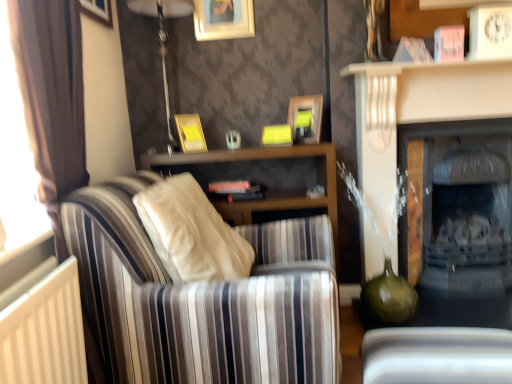
Question: Can you confirm if striped fabric couch at left is taller than matte black fireplace at right, which is the first fireplace from back to front?

Choices:
 (A) yes
 (B) no

Answer: (B)

Question: Is matte black fireplace at right, the 2th fireplace viewed from the front, inside striped fabric couch at left?

Choices:
 (A) no
 (B) yes

Answer: (A)

Question: Does striped fabric couch at left appear on the left side of matte black fireplace at right, the 2th fireplace viewed from the front?

Choices:
 (A) no
 (B) yes

Answer: (B)

Question: Considering the relative sizes of striped fabric couch at left and matte black fireplace at right, which is the first fireplace from back to front, in the image provided, is striped fabric couch at left shorter than matte black fireplace at right, which is the first fireplace from back to front,?

Choices:
 (A) yes
 (B) no

Answer: (A)

Question: Are striped fabric couch at left and matte black fireplace at right, which is the first fireplace from back to front, located far from each other?

Choices:
 (A) no
 (B) yes

Answer: (B)

Question: Is wooden picture frame at upper center, arranged as the 3th picture frame when viewed from the top, inside the boundaries of wooden picture frame at upper left, the 1th picture frame positioned from the left, or outside?

Choices:
 (A) inside
 (B) outside

Answer: (B)

Question: Visually, is wooden picture frame at upper center, arranged as the 3th picture frame when viewed from the top, positioned to the left or to the right of wooden picture frame at upper left, positioned as the fifth picture frame in right-to-left order?

Choices:
 (A) left
 (B) right

Answer: (B)

Question: In the image, is wooden picture frame at upper center, the 1th picture frame in the right-to-left sequence, positioned in front of or behind wooden picture frame at upper left, positioned as the fifth picture frame in right-to-left order?

Choices:
 (A) front
 (B) behind

Answer: (B)

Question: Does point (309, 142) appear closer or farther from the camera than point (99, 11)?

Choices:
 (A) closer
 (B) farther

Answer: (B)

Question: Is wooden picture frame at upper center, the 1th picture frame positioned from the top, to the left or to the right of striped fabric couch at left in the image?

Choices:
 (A) right
 (B) left

Answer: (B)

Question: Choose the correct answer: Is wooden picture frame at upper center, which is counted as the 3th picture frame, starting from the left, inside striped fabric couch at left or outside it?

Choices:
 (A) outside
 (B) inside

Answer: (A)

Question: From the image's perspective, relative to striped fabric couch at left, is wooden picture frame at upper center, the third picture frame when ordered from right to left, above or below?

Choices:
 (A) below
 (B) above

Answer: (B)

Question: From a real-world perspective, is wooden picture frame at upper center, which is counted as the 3th picture frame, starting from the left, physically located above or below striped fabric couch at left?

Choices:
 (A) below
 (B) above

Answer: (B)

Question: Does point (93, 3) appear closer or farther from the camera than point (164, 66)?

Choices:
 (A) farther
 (B) closer

Answer: (B)

Question: From a real-world perspective, is wooden picture frame at upper left, the 1th picture frame positioned from the left, positioned above or below metallic silver table lamp at upper center?

Choices:
 (A) above
 (B) below

Answer: (A)